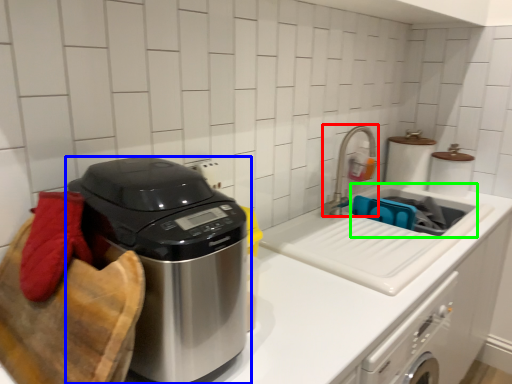
Question: Based on their relative distances, which object is farther from faucet (highlighted by a red box)? Choose from home appliance (highlighted by a blue box) and sink (highlighted by a green box).

Choices:
 (A) home appliance
 (B) sink

Answer: (A)